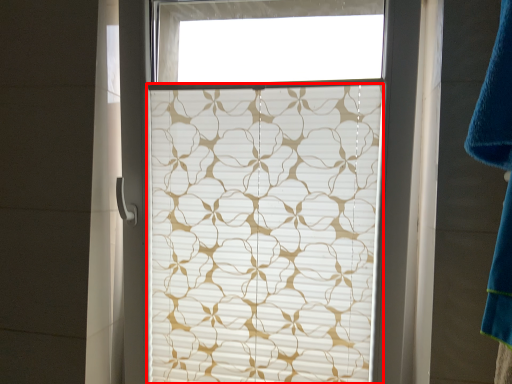
Question: From the image's perspective, where is window blind (annotated by the red box) located relative to bath towel?

Choices:
 (A) below
 (B) above

Answer: (A)